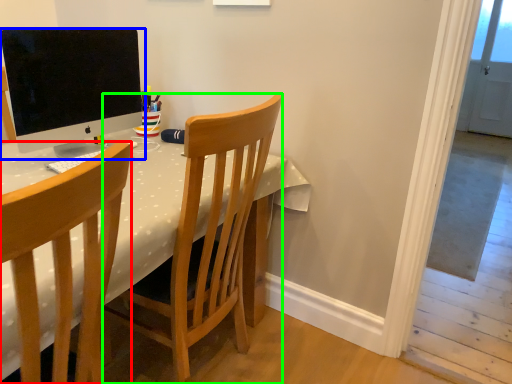
Question: Which object is positioned closest to chair (highlighted by a red box)? Select from computer monitor (highlighted by a blue box) and chair (highlighted by a green box).

Choices:
 (A) computer monitor
 (B) chair

Answer: (B)